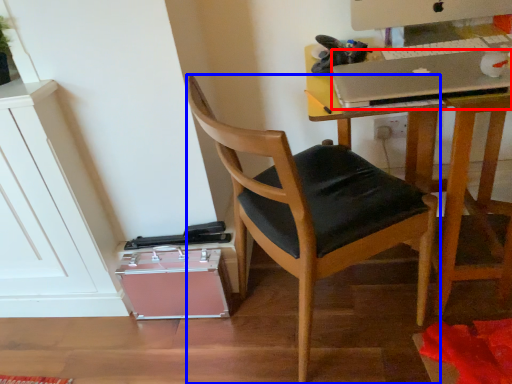
Question: Among these objects, which one is nearest to the camera, laptop (highlighted by a red box) or chair (highlighted by a blue box)?

Choices:
 (A) laptop
 (B) chair

Answer: (B)